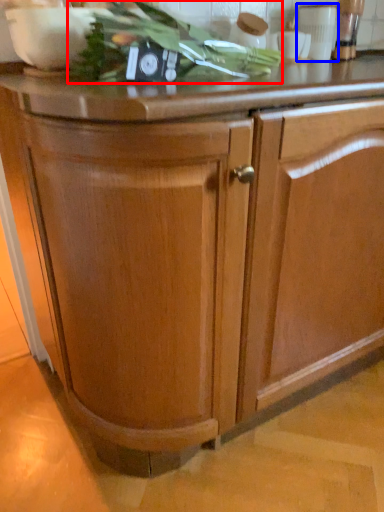
Question: Which of the following is the farthest to the observer, vegetable (highlighted by a red box) or appliance (highlighted by a blue box)?

Choices:
 (A) vegetable
 (B) appliance

Answer: (B)